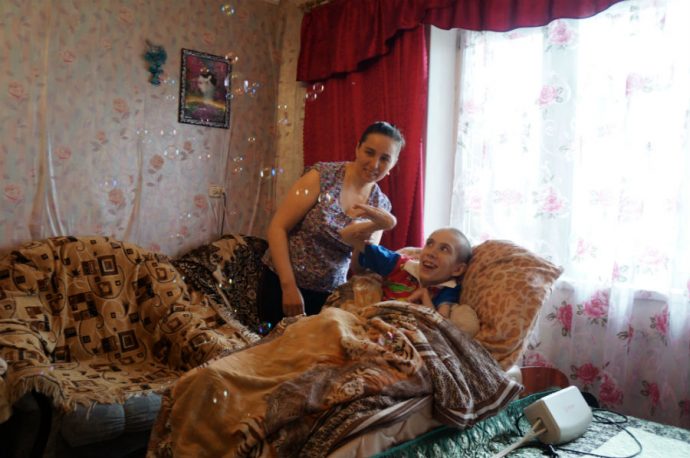
At what (x,y) coordinates should I click in order to perform the action: click on curtain. Please return your answer as a coordinate pair (x, y). Looking at the image, I should click on (404, 187), (539, 189).